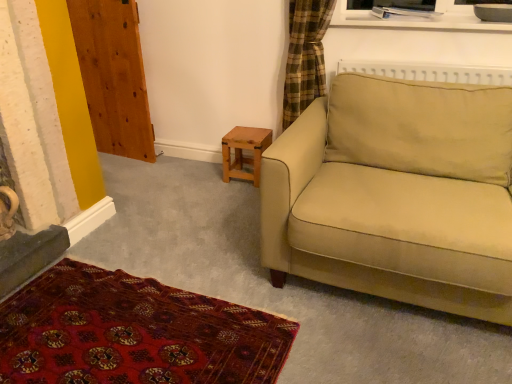
Question: Is the position of carpet with intricate patterns at lower left more distant than that of wooden at left?

Choices:
 (A) no
 (B) yes

Answer: (A)

Question: Considering the relative sizes of carpet with intricate patterns at lower left and wooden at left in the image provided, is carpet with intricate patterns at lower left wider than wooden at left?

Choices:
 (A) yes
 (B) no

Answer: (A)

Question: Is carpet with intricate patterns at lower left directly adjacent to wooden at left?

Choices:
 (A) no
 (B) yes

Answer: (A)

Question: Can you confirm if carpet with intricate patterns at lower left is bigger than wooden at left?

Choices:
 (A) yes
 (B) no

Answer: (B)

Question: Considering the relative positions of carpet with intricate patterns at lower left and wooden at left in the image provided, is carpet with intricate patterns at lower left to the left of wooden at left from the viewer's perspective?

Choices:
 (A) yes
 (B) no

Answer: (B)

Question: Considering the relative sizes of carpet with intricate patterns at lower left and wooden at left in the image provided, is carpet with intricate patterns at lower left smaller than wooden at left?

Choices:
 (A) yes
 (B) no

Answer: (A)

Question: Is wooden stool at lower center outside wooden at left?

Choices:
 (A) yes
 (B) no

Answer: (A)

Question: Considering the relative sizes of wooden stool at lower center and wooden at left in the image provided, is wooden stool at lower center thinner than wooden at left?

Choices:
 (A) yes
 (B) no

Answer: (B)

Question: Is wooden stool at lower center wider than wooden at left?

Choices:
 (A) yes
 (B) no

Answer: (A)

Question: Is wooden stool at lower center turned away from wooden at left?

Choices:
 (A) yes
 (B) no

Answer: (B)

Question: Considering the relative sizes of wooden stool at lower center and wooden at left in the image provided, is wooden stool at lower center smaller than wooden at left?

Choices:
 (A) yes
 (B) no

Answer: (A)

Question: Could you tell me if wooden stool at lower center is turned towards wooden at left?

Choices:
 (A) no
 (B) yes

Answer: (A)

Question: Is carpet with intricate patterns at lower left oriented towards beige fabric couch at right?

Choices:
 (A) no
 (B) yes

Answer: (A)